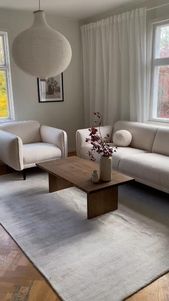
At what (x,y) coordinates should I click in order to perform the action: click on flower pot. Please return your answer as a coordinate pair (x, y). The height and width of the screenshot is (301, 169). Looking at the image, I should click on (105, 169).